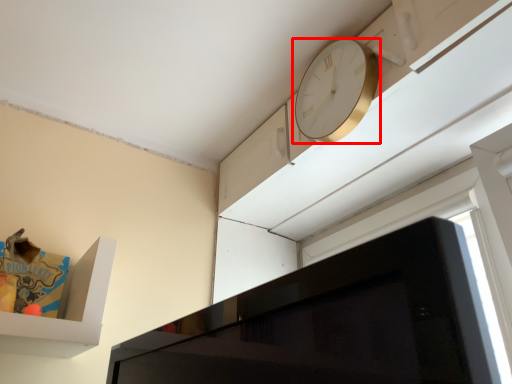
Question: From the image's perspective, where is clock (annotated by the red box) located relative to window?

Choices:
 (A) below
 (B) above

Answer: (B)